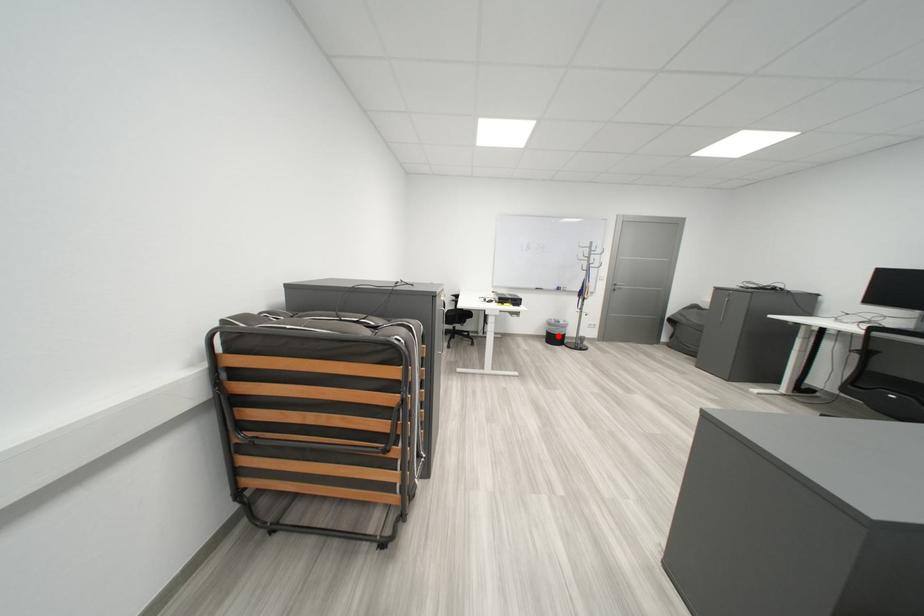
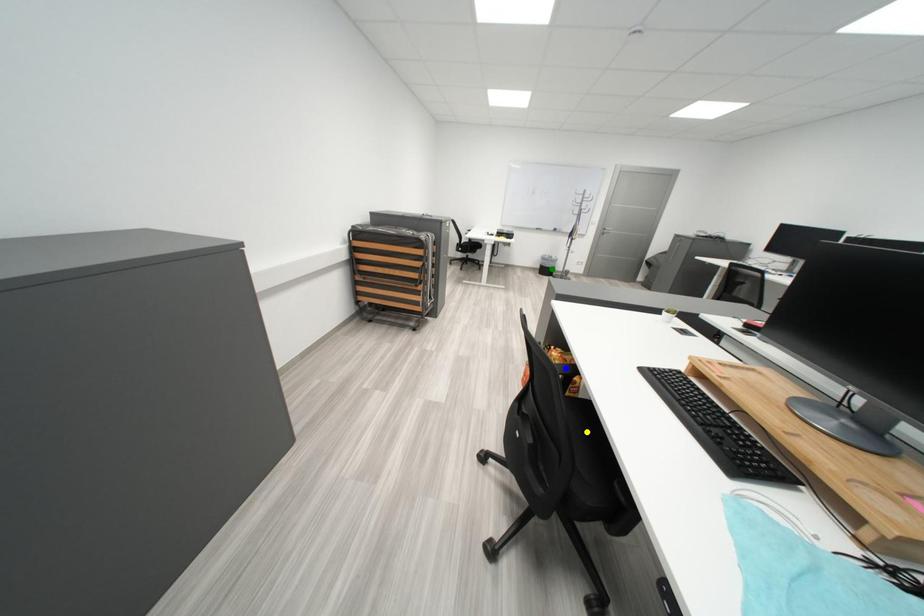
Question: I am providing you with two images of the same scene from different viewpoints. A red point is marked on the first image. You are given multiple points on the second image. Can you choose the point in image 2 that corresponds to the point in image 1?

Choices:
 (A) green point
 (B) blue point
 (C) yellow point

Answer: (A)